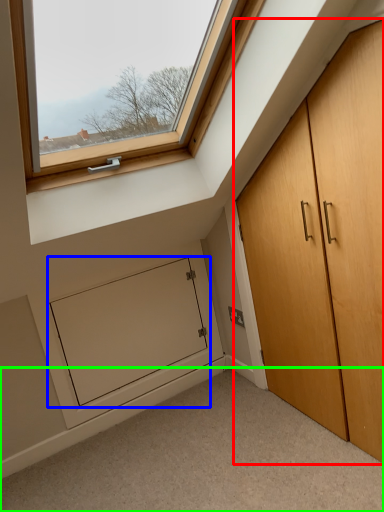
Question: Considering the real-world distances, which object is closest to cupboard (highlighted by a red box)? screen door (highlighted by a blue box) or corridor (highlighted by a green box).

Choices:
 (A) screen door
 (B) corridor

Answer: (B)